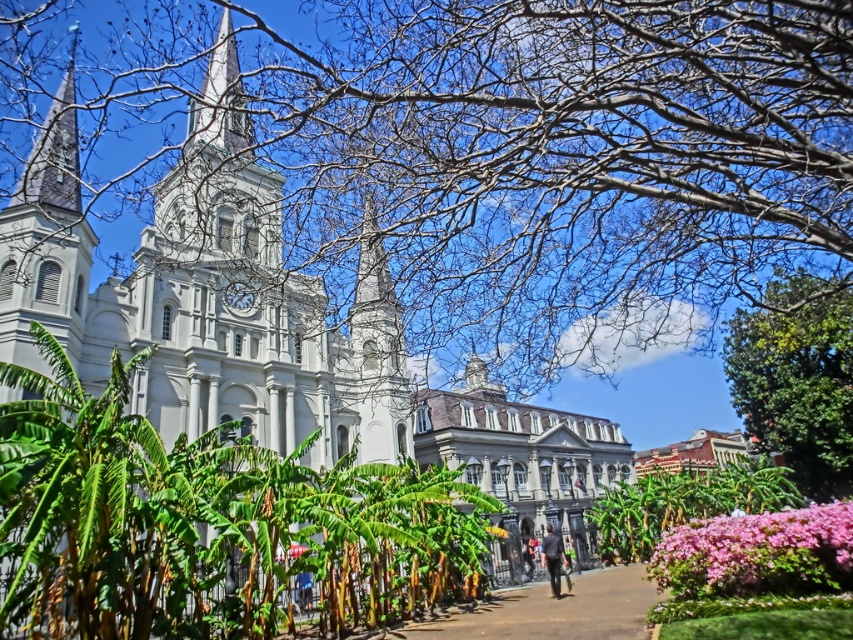
Question: Which object is closer to the camera taking this photo?

Choices:
 (A) bare branches at upper center
 (B) green leafy tree at center
 (C) green leafy tree at right
 (D) white stone building at center

Answer: (B)

Question: Does green leafy tree at right have a larger size compared to pink matte flower at lower right?

Choices:
 (A) yes
 (B) no

Answer: (A)

Question: Estimate the real-world distances between objects in this image. Which object is farther from the bare branches at upper center?

Choices:
 (A) brown paved path at center
 (B) pink matte flower at lower right

Answer: (A)

Question: Can you confirm if bare branches at upper center is thinner than white stone building at center?

Choices:
 (A) yes
 (B) no

Answer: (B)

Question: Is bare branches at upper center closer to camera compared to pink matte flower at lower right?

Choices:
 (A) no
 (B) yes

Answer: (B)

Question: Which point appears farthest from the camera in this image?

Choices:
 (A) (210, 618)
 (B) (817, 381)
 (C) (479, 612)

Answer: (B)